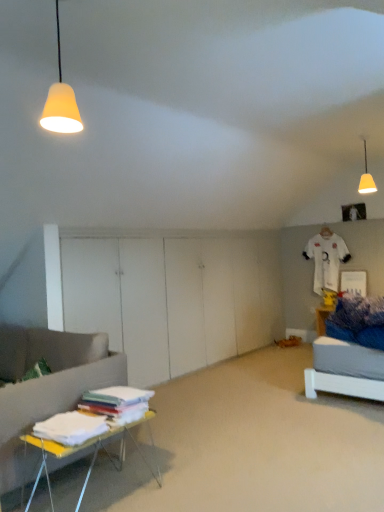
Question: Considering the relative sizes of matte yellow cone at upper left, the 2th lamp from the right, and white fabric stack at lower left in the image provided, is matte yellow cone at upper left, the 2th lamp from the right, smaller than white fabric stack at lower left?

Choices:
 (A) yes
 (B) no

Answer: (A)

Question: Does matte yellow cone at upper left, arranged as the second lamp when viewed from the back, come behind white fabric stack at lower left?

Choices:
 (A) no
 (B) yes

Answer: (B)

Question: From the image's perspective, is matte yellow cone at upper left, arranged as the second lamp when viewed from the back, on top of white fabric stack at lower left?

Choices:
 (A) no
 (B) yes

Answer: (B)

Question: Is matte yellow cone at upper left, the 2th lamp from the right, thinner than white fabric stack at lower left?

Choices:
 (A) yes
 (B) no

Answer: (A)

Question: Is matte yellow cone at upper left, the 2th lamp from the right, to the right of white fabric stack at lower left from the viewer's perspective?

Choices:
 (A) yes
 (B) no

Answer: (B)

Question: In terms of width, does white plastic table at lower left look wider or thinner when compared to white cotton sheets at lower left?

Choices:
 (A) thin
 (B) wide

Answer: (B)

Question: Choose the correct answer: Is white plastic table at lower left inside white cotton sheets at lower left or outside it?

Choices:
 (A) outside
 (B) inside

Answer: (A)

Question: Is white plastic table at lower left to the left or to the right of white cotton sheets at lower left in the image?

Choices:
 (A) right
 (B) left

Answer: (A)

Question: From the image's perspective, is white plastic table at lower left above or below white cotton sheets at lower left?

Choices:
 (A) above
 (B) below

Answer: (B)

Question: From their relative heights in the image, would you say white fabric stack at lower left is taller or shorter than white cotton sheets at lower left?

Choices:
 (A) tall
 (B) short

Answer: (A)

Question: From a real-world perspective, is white fabric stack at lower left above or below white cotton sheets at lower left?

Choices:
 (A) above
 (B) below

Answer: (B)

Question: Considering their positions, is white fabric stack at lower left located in front of or behind white cotton sheets at lower left?

Choices:
 (A) behind
 (B) front

Answer: (B)

Question: Considering the positions of point (216, 463) and point (79, 416), is point (216, 463) closer or farther from the camera than point (79, 416)?

Choices:
 (A) closer
 (B) farther

Answer: (B)

Question: Is matte yellow lampshade at upper right, which is the 1th lamp from back to front, inside or outside of white cotton sheets at lower left?

Choices:
 (A) outside
 (B) inside

Answer: (A)

Question: From a real-world perspective, is matte yellow lampshade at upper right, the 1th lamp from the right, positioned above or below white cotton sheets at lower left?

Choices:
 (A) above
 (B) below

Answer: (A)